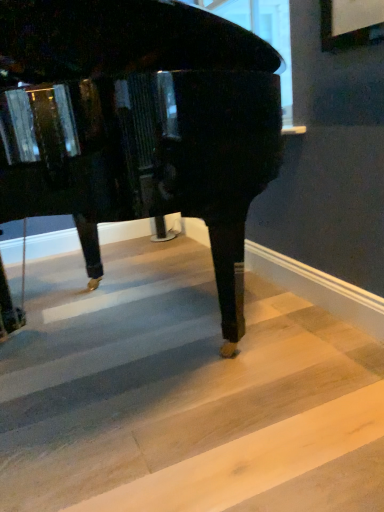
At what (x,y) coordinates should I click in order to perform the action: click on glossy black piano at center. Please return your answer as a coordinate pair (x, y). The image size is (384, 512). Looking at the image, I should click on (139, 124).

Measure the distance between glossy black piano at center and camera.

The distance of glossy black piano at center from camera is 95.49 centimeters.

Describe the element at coordinates (139, 124) in the screenshot. I see `glossy black piano at center` at that location.

Locate an element on the screen. Image resolution: width=384 pixels, height=512 pixels. light wood stair at lower right is located at coordinates (184, 395).

The height and width of the screenshot is (512, 384). Describe the element at coordinates (184, 395) in the screenshot. I see `light wood stair at lower right` at that location.

Measure the distance between point (141, 464) and camera.

Point (141, 464) and camera are 1.16 meters apart from each other.

The width and height of the screenshot is (384, 512). Find the location of `glossy black piano at center`. glossy black piano at center is located at coordinates (139, 124).

Can you confirm if glossy black piano at center is positioned to the left of light wood stair at lower right?

Indeed, glossy black piano at center is positioned on the left side of light wood stair at lower right.

Considering the positions of objects glossy black piano at center and light wood stair at lower right in the image provided, who is behind, glossy black piano at center or light wood stair at lower right?

light wood stair at lower right.

Is point (260, 89) farther from camera compared to point (156, 349)?

No.

From the image's perspective, which one is positioned lower, glossy black piano at center or light wood stair at lower right?

light wood stair at lower right.

From a real-world perspective, who is located higher, glossy black piano at center or light wood stair at lower right?

In real-world perspective, glossy black piano at center is above.

Consider the image. Between glossy black piano at center and light wood stair at lower right, which one has smaller width?

glossy black piano at center is thinner.

In terms of height, does glossy black piano at center look taller or shorter compared to light wood stair at lower right?

Considering their sizes, glossy black piano at center has more height than light wood stair at lower right.

Is glossy black piano at center bigger or smaller than light wood stair at lower right?

glossy black piano at center is bigger than light wood stair at lower right.

Is glossy black piano at center surrounding light wood stair at lower right?

No, light wood stair at lower right is located outside of glossy black piano at center.

Are glossy black piano at center and light wood stair at lower right far apart?

They are positioned close to each other.

Could you tell me if glossy black piano at center is turned towards light wood stair at lower right?

No, glossy black piano at center is not oriented towards light wood stair at lower right.

What's the angular difference between glossy black piano at center and light wood stair at lower right's facing directions?

36.5 degrees separate the facing orientations of glossy black piano at center and light wood stair at lower right.

At what (x,y) coordinates should I click in order to perform the action: click on stairwell beneath the glossy black piano at center (from a real-world perspective). Please return your answer as a coordinate pair (x, y). Looking at the image, I should click on (184, 395).

Does light wood stair at lower right appear on the right side of glossy black piano at center?

Yes.

Does light wood stair at lower right come behind glossy black piano at center?

Yes, light wood stair at lower right is further from the viewer.

Between point (28, 417) and point (135, 31), which one is positioned behind?

The point (135, 31) is farther from the camera.

From the image's perspective, is light wood stair at lower right located beneath glossy black piano at center?

Yes.

From a real-world perspective, does light wood stair at lower right stand above glossy black piano at center?

No, from a real-world perspective, light wood stair at lower right is not over glossy black piano at center

Considering the sizes of light wood stair at lower right and glossy black piano at center in the image, is light wood stair at lower right wider or thinner than glossy black piano at center?

light wood stair at lower right is wider than glossy black piano at center.

Who is shorter, light wood stair at lower right or glossy black piano at center?

With less height is light wood stair at lower right.

Does light wood stair at lower right have a larger size compared to glossy black piano at center?

No.

Could glossy black piano at center be considered to be inside light wood stair at lower right?

No, glossy black piano at center is not a part of light wood stair at lower right.

Is light wood stair at lower right placed right next to glossy black piano at center?

No, light wood stair at lower right is not with glossy black piano at center.

Is light wood stair at lower right looking in the opposite direction of glossy black piano at center?

No.

Locate an element on the screen. The width and height of the screenshot is (384, 512). stairwell that appears on the right of glossy black piano at center is located at coordinates (184, 395).

This screenshot has height=512, width=384. I want to click on piano that is on the left side of light wood stair at lower right, so click(x=139, y=124).

What are the coordinates of `piano that appears in front of the light wood stair at lower right` in the screenshot? It's located at (139, 124).